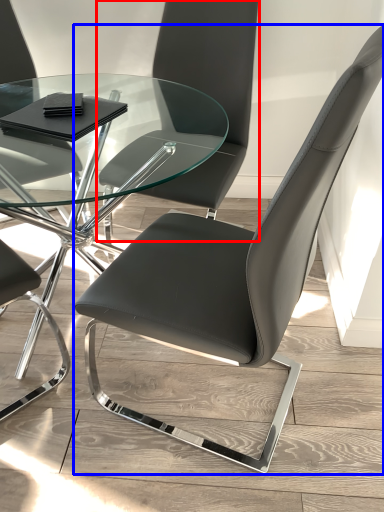
Question: Among these objects, which one is nearest to the camera, chair (highlighted by a red box) or chair (highlighted by a blue box)?

Choices:
 (A) chair
 (B) chair

Answer: (B)